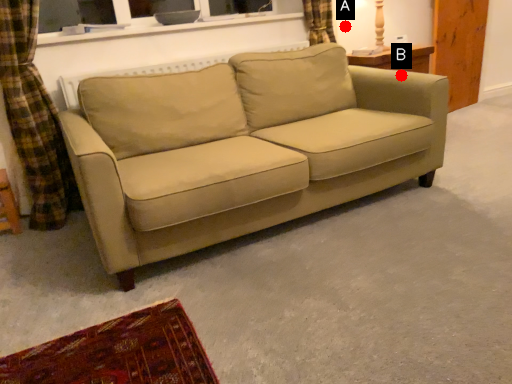
Question: Two points are circled on the image, labeled by A and B beside each circle. Which of the following is the farthest from the observer?

Choices:
 (A) A is further
 (B) B is further

Answer: (A)